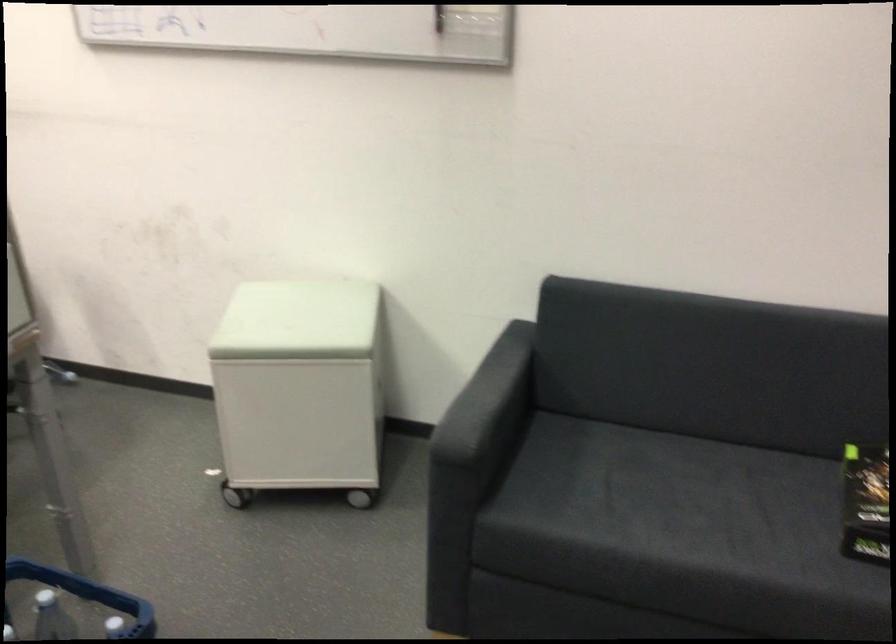
Locate an element on the screen. sofa armrest is located at coordinates (487, 401).